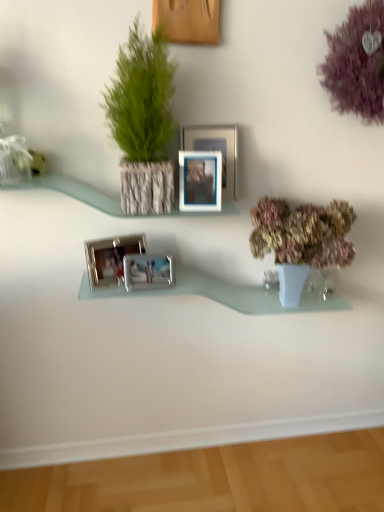
Question: From a real-world perspective, is silver metallic photo frame at center, which ranks as the 2th picture frame in bottom-to-top order, positioned under purple fluffy flower at upper right based on gravity?

Choices:
 (A) no
 (B) yes

Answer: (B)

Question: From a real-world perspective, is silver metallic photo frame at center, which ranks as the 4th picture frame in top-to-bottom order, over purple fluffy flower at upper right?

Choices:
 (A) yes
 (B) no

Answer: (B)

Question: Can you confirm if silver metallic photo frame at center, which ranks as the 4th picture frame in top-to-bottom order, is shorter than purple fluffy flower at upper right?

Choices:
 (A) yes
 (B) no

Answer: (A)

Question: Is silver metallic photo frame at center, which ranks as the 4th picture frame in top-to-bottom order, positioned with its back to purple fluffy flower at upper right?

Choices:
 (A) no
 (B) yes

Answer: (A)

Question: Considering the relative positions of silver metallic photo frame at center, which ranks as the 2th picture frame in bottom-to-top order, and purple fluffy flower at upper right in the image provided, is silver metallic photo frame at center, which ranks as the 2th picture frame in bottom-to-top order, behind purple fluffy flower at upper right?

Choices:
 (A) no
 (B) yes

Answer: (B)

Question: Can you confirm if silver metallic photo frame at center, which ranks as the 2th picture frame in bottom-to-top order, is taller than purple fluffy flower at upper right?

Choices:
 (A) no
 (B) yes

Answer: (A)

Question: Considering the relative sizes of clear glass vase at lower right and silver metallic picture frame at upper center, the fourth picture frame when ordered from bottom to top, in the image provided, is clear glass vase at lower right taller than silver metallic picture frame at upper center, the fourth picture frame when ordered from bottom to top,?

Choices:
 (A) yes
 (B) no

Answer: (B)

Question: From a real-world perspective, is clear glass vase at lower right located higher than silver metallic picture frame at upper center, the second picture frame positioned from the top?

Choices:
 (A) yes
 (B) no

Answer: (B)

Question: Does clear glass vase at lower right have a greater width compared to silver metallic picture frame at upper center, the fourth picture frame when ordered from bottom to top?

Choices:
 (A) no
 (B) yes

Answer: (A)

Question: Considering the relative sizes of clear glass vase at lower right and silver metallic picture frame at upper center, the second picture frame positioned from the top, in the image provided, is clear glass vase at lower right smaller than silver metallic picture frame at upper center, the second picture frame positioned from the top,?

Choices:
 (A) no
 (B) yes

Answer: (B)

Question: Is silver metallic picture frame at upper center, the second picture frame positioned from the top, at the back of clear glass vase at lower right?

Choices:
 (A) yes
 (B) no

Answer: (B)

Question: Is clear glass vase at lower right at the left side of silver metallic picture frame at upper center, the fourth picture frame when ordered from bottom to top?

Choices:
 (A) yes
 (B) no

Answer: (B)

Question: Is green textured plant at upper left, arranged as the second houseplant when ordered from the bottom, bigger than silver metallic photo frame at center, which ranks as the 2th picture frame in bottom-to-top order?

Choices:
 (A) yes
 (B) no

Answer: (A)